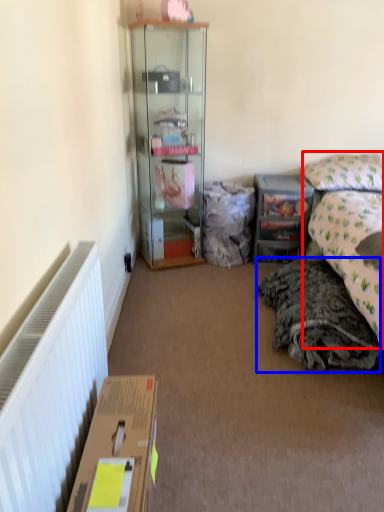
Question: Which point is closer to the camera, bed (highlighted by a red box) or material (highlighted by a blue box)?

Choices:
 (A) bed
 (B) material

Answer: (A)